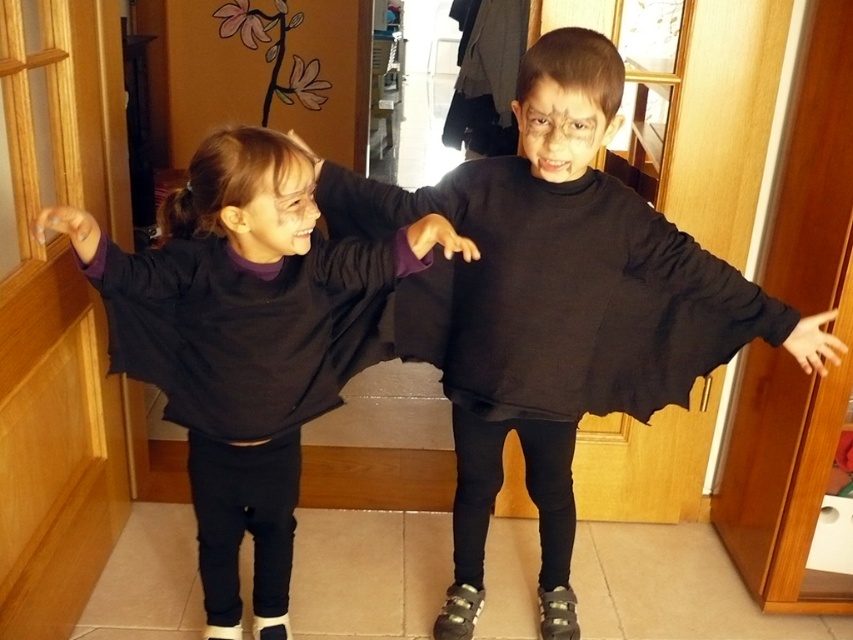
Can you confirm if black matte sweater at center is positioned to the left of matte black sweater at center?

Incorrect, black matte sweater at center is not on the left side of matte black sweater at center.

Who is shorter, black matte sweater at center or matte black sweater at center?

With less height is matte black sweater at center.

Does point (636, 260) come behind point (257, 188)?

Yes, point (636, 260) is behind point (257, 188).

This screenshot has width=853, height=640. Identify the location of black matte sweater at center. (548, 300).